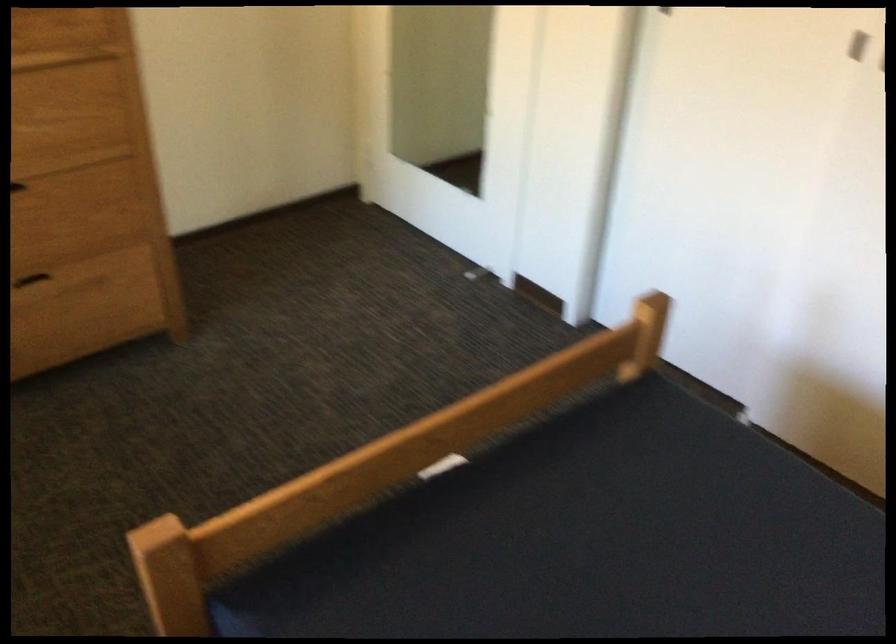
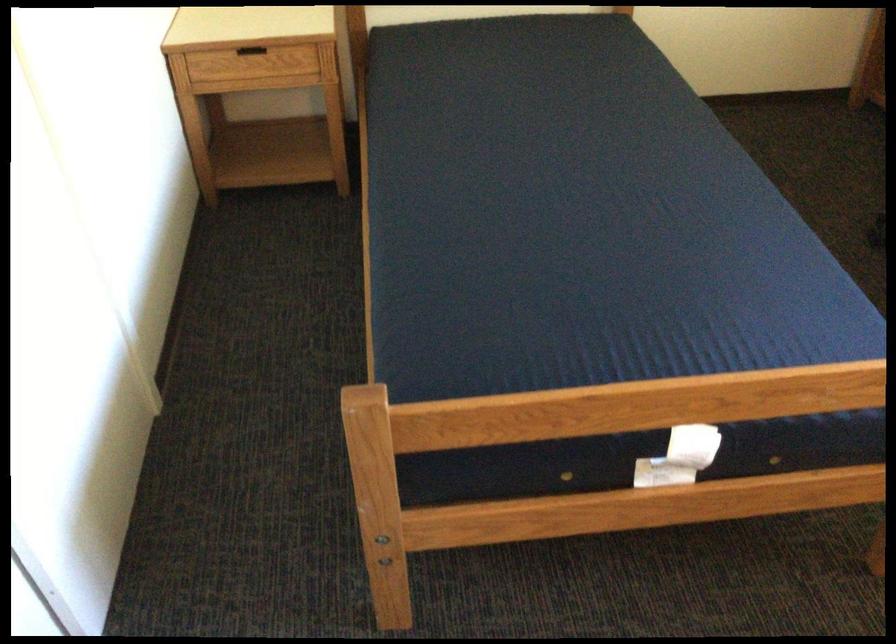
In the second image, find the point that corresponds to [453,477] in the first image.

(679, 457)